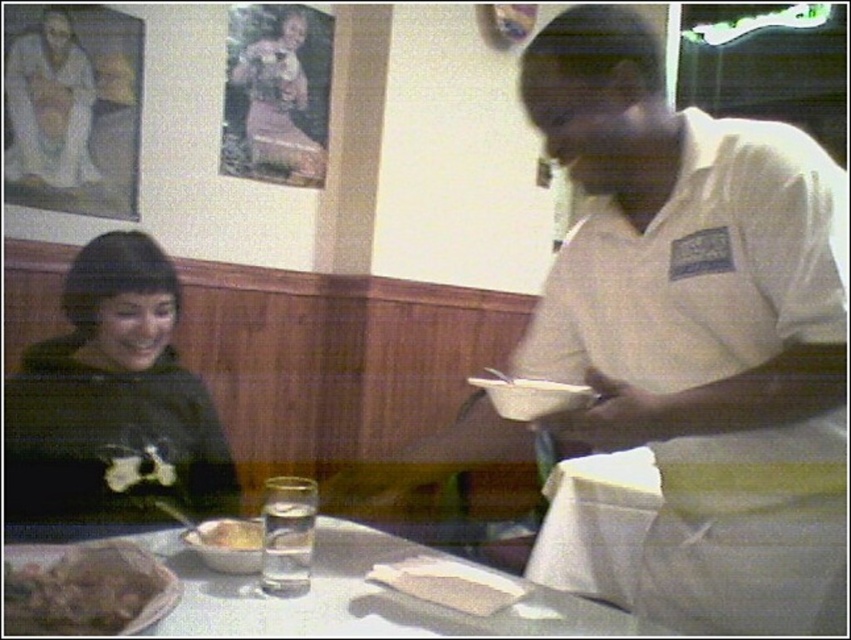
You are a customer in the restaurant and want to ask the server about the rice bowl. Which direction should you look to see both the white uniform at right and the yellowish matte rice bowl at lower left?

You should look towards the right side of the image where the white uniform at right is located, as it is positioned to the right of the yellowish matte rice bowl at lower left.

Based on the photo, you are a customer sitting at the table in the restaurant. You want to reach the point at coordinates point [101,545] and point [50,65]. Which point is closer to your current position?

Point [101,545] is in front of point [50,65], so the point [101,545] is closer to your current position.

You are a customer sitting at the table and you want to reach for the brown crumbly bread at lower left. Is the bread under the matte white shirt at upper left?

Yes, the brown crumbly bread at lower left is positioned under the matte white shirt at upper left according to the description.